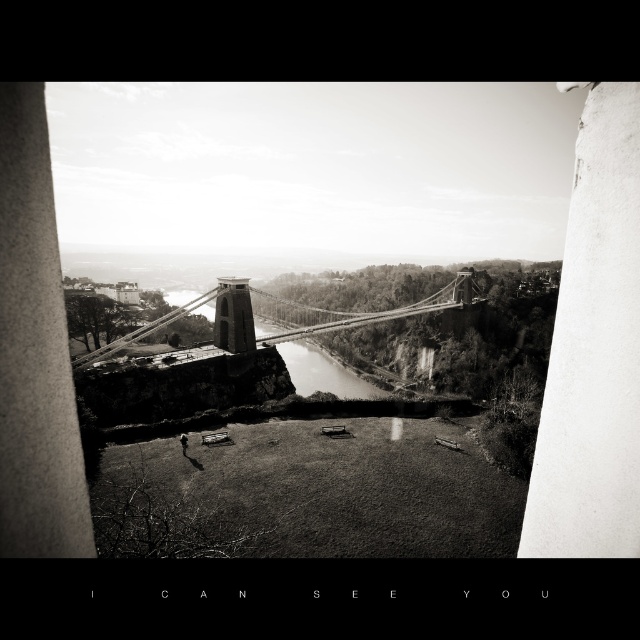
Image resolution: width=640 pixels, height=640 pixels. Describe the element at coordinates (593, 349) in the screenshot. I see `white smooth pillar at center right` at that location.

Does white smooth pillar at center right appear under metallic wire suspension bridge at center?

Indeed, white smooth pillar at center right is positioned under metallic wire suspension bridge at center.

Find the location of `white smooth pillar at center right`. white smooth pillar at center right is located at coordinates (593, 349).

Is point (4, 188) farther from viewer compared to point (264, 301)?

No, it is in front of (264, 301).

Is point (61, 320) positioned before point (129, 337)?

Yes, it is.

In order to click on smooth concrete pillar at left in this screenshot , I will do `click(35, 349)`.

Where is `smooth concrete pillar at left`? This screenshot has height=640, width=640. smooth concrete pillar at left is located at coordinates (35, 349).

Does white smooth pillar at center right appear on the right side of smooth concrete pillar at left?

Correct, you'll find white smooth pillar at center right to the right of smooth concrete pillar at left.

Is point (561, 554) positioned after point (54, 467)?

That is True.

Where is `white smooth pillar at center right`? white smooth pillar at center right is located at coordinates (593, 349).